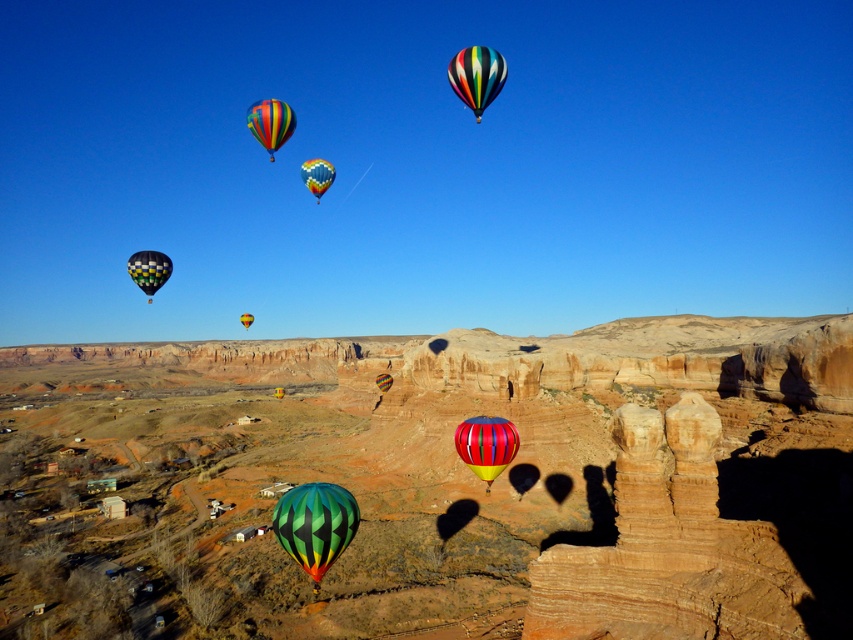
Question: Based on their relative distances, which object is nearer to the multicolored striped hot air balloon at center?

Choices:
 (A) multicolored glossy hot air balloon at center
 (B) green striped balloon at center

Answer: (B)

Question: Where is multicolored striped hot air balloon at upper left located in relation to multicolored striped hot air balloon at center in the image?

Choices:
 (A) right
 (B) left

Answer: (A)

Question: Does multicolored glossy hot air balloon at center appear on the right side of multicolored fabric hot air balloon at left?

Choices:
 (A) yes
 (B) no

Answer: (A)

Question: Which point is closer to the camera?

Choices:
 (A) (273, 120)
 (B) (381, 388)

Answer: (A)

Question: Which object appears closest to the camera in this image?

Choices:
 (A) rainbow striped hot air balloon at upper center
 (B) multicolored fabric hot air balloon at center

Answer: (A)

Question: Can you confirm if green striped balloon at center is positioned to the left of multicolored striped hot air balloon at upper left?

Choices:
 (A) yes
 (B) no

Answer: (B)